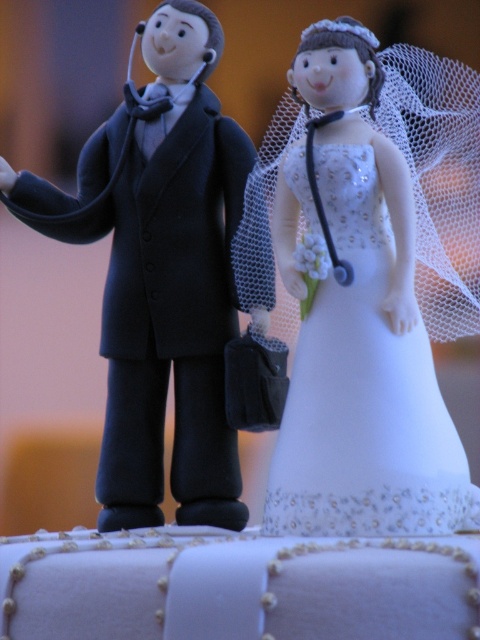
Can you confirm if white glossy wedding dress at upper center is taller than matte black suit at left?

No, white glossy wedding dress at upper center is not taller than matte black suit at left.

Does white glossy wedding dress at upper center have a greater width compared to matte black suit at left?

No, white glossy wedding dress at upper center is not wider than matte black suit at left.

Which is in front, point (292, 228) or point (194, 232)?

Point (292, 228) is in front.

At what (x,y) coordinates should I click in order to perform the action: click on white glossy wedding dress at upper center. Please return your answer as a coordinate pair (x, y). Image resolution: width=480 pixels, height=640 pixels. Looking at the image, I should click on (372, 284).